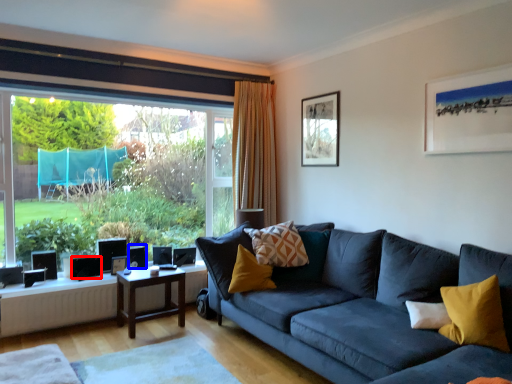
Question: Which object is closer to the camera taking this photo, speaker (highlighted by a red box) or speaker (highlighted by a blue box)?

Choices:
 (A) speaker
 (B) speaker

Answer: (A)